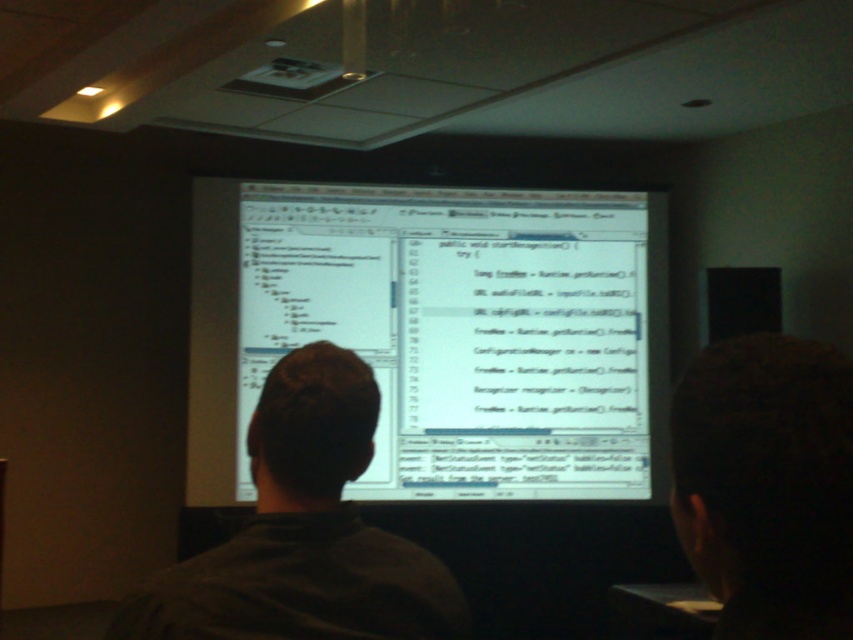
Question: Does white glossy computer monitor at center have a lesser width compared to dark gray shirt at center?

Choices:
 (A) yes
 (B) no

Answer: (B)

Question: Among these points, which one is nearest to the camera?

Choices:
 (A) (393, 358)
 (B) (334, 561)

Answer: (B)

Question: Considering the relative positions of white glossy computer monitor at center and dark gray shirt at center in the image provided, where is white glossy computer monitor at center located with respect to dark gray shirt at center?

Choices:
 (A) right
 (B) left

Answer: (A)

Question: Which point is closer to the camera taking this photo?

Choices:
 (A) (521, 218)
 (B) (287, 412)

Answer: (B)

Question: Can you confirm if white glossy computer monitor at center is smaller than dark gray shirt at center?

Choices:
 (A) yes
 (B) no

Answer: (B)